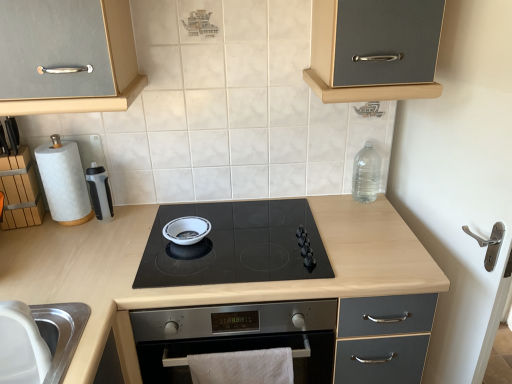
This screenshot has width=512, height=384. Identify the location of vacant area in front of wooden block at left. (22, 248).